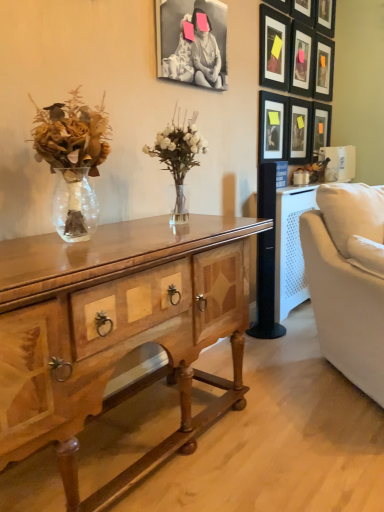
Question: Should I look upward or downward to see matte black picture frame at upper right, arranged as the eighth picture frame when viewed from the right?

Choices:
 (A) down
 (B) up

Answer: (B)

Question: Which direction should I rotate to look at black matte picture frame at upper center, arranged as the 1th picture frame when viewed from the left?

Choices:
 (A) left
 (B) right

Answer: (B)

Question: Is matte black picture frame at upper right, which appears as the sixth picture frame when viewed from the left, behind matte black picture frame at upper right, the third picture frame viewed from the left?

Choices:
 (A) yes
 (B) no

Answer: (A)

Question: Is matte black picture frame at upper right, which appears as the sixth picture frame when viewed from the left, outside of matte black picture frame at upper right, the seventh picture frame in the right-to-left sequence?

Choices:
 (A) yes
 (B) no

Answer: (A)

Question: From the image's perspective, is matte black picture frame at upper right, which appears as the sixth picture frame when viewed from the left, above matte black picture frame at upper right, the seventh picture frame in the right-to-left sequence?

Choices:
 (A) no
 (B) yes

Answer: (B)

Question: Is matte black picture frame at upper right, which ranks as the fourth picture frame in right-to-left order, next to matte black picture frame at upper right, the seventh picture frame in the right-to-left sequence?

Choices:
 (A) yes
 (B) no

Answer: (B)

Question: Is the position of matte black picture frame at upper right, which ranks as the fourth picture frame in right-to-left order, less distant than that of matte black picture frame at upper right, the seventh picture frame in the right-to-left sequence?

Choices:
 (A) no
 (B) yes

Answer: (A)

Question: Can you confirm if matte black picture frame at upper right, which ranks as the fourth picture frame in right-to-left order, is positioned to the right of matte black picture frame at upper right, the third picture frame viewed from the left?

Choices:
 (A) no
 (B) yes

Answer: (B)

Question: From the image's perspective, is matte black picture frame at upper right, the seventh picture frame in the right-to-left sequence, on top of matte black picture frame at upper right, which ranks as the fourth picture frame in right-to-left order?

Choices:
 (A) no
 (B) yes

Answer: (A)

Question: Does matte black picture frame at upper right, the seventh picture frame in the right-to-left sequence, lie in front of matte black picture frame at upper right, which appears as the sixth picture frame when viewed from the left?

Choices:
 (A) yes
 (B) no

Answer: (A)

Question: Considering the relative sizes of matte black picture frame at upper right, the seventh picture frame in the right-to-left sequence, and matte black picture frame at upper right, which ranks as the fourth picture frame in right-to-left order, in the image provided, is matte black picture frame at upper right, the seventh picture frame in the right-to-left sequence, wider than matte black picture frame at upper right, which ranks as the fourth picture frame in right-to-left order,?

Choices:
 (A) no
 (B) yes

Answer: (A)

Question: Is matte black picture frame at upper right, the seventh picture frame in the right-to-left sequence, facing away from matte black picture frame at upper right, which ranks as the fourth picture frame in right-to-left order?

Choices:
 (A) no
 (B) yes

Answer: (A)

Question: Could you tell me if matte black picture frame at upper right, the seventh picture frame in the right-to-left sequence, is turned towards matte black picture frame at upper right, which ranks as the fourth picture frame in right-to-left order?

Choices:
 (A) no
 (B) yes

Answer: (A)

Question: Is matte black picture frame at upper right, the seventh picture frame in the right-to-left sequence, smaller than matte black picture frame at upper right, which ranks as the fourth picture frame in right-to-left order?

Choices:
 (A) no
 (B) yes

Answer: (B)

Question: From a real-world perspective, is matte black picture frame at upper right, the first picture frame viewed from the right, on top of wooden desk at center?

Choices:
 (A) no
 (B) yes

Answer: (B)